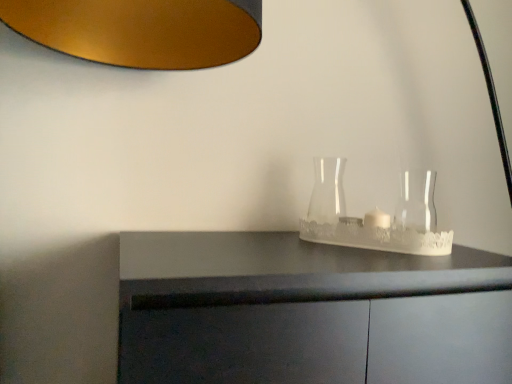
Question: In the image, is transparent glass vase at center, placed as the 1th glass vase when sorted from left to right, positioned in front of or behind transparent glass vase at right, which is counted as the first glass vase, starting from the right?

Choices:
 (A) front
 (B) behind

Answer: (B)

Question: Visually, is transparent glass vase at center, the second glass vase positioned from the right, positioned to the left or to the right of transparent glass vase at right, the second glass vase viewed from the left?

Choices:
 (A) left
 (B) right

Answer: (A)

Question: Is point (322, 192) closer or farther from the camera than point (433, 206)?

Choices:
 (A) farther
 (B) closer

Answer: (B)

Question: From a real-world perspective, relative to transparent glass vase at center, placed as the 1th glass vase when sorted from left to right, is transparent glass vase at right, the second glass vase viewed from the left, vertically above or below?

Choices:
 (A) below
 (B) above

Answer: (A)

Question: Relative to transparent glass vase at center, the second glass vase positioned from the right, is transparent glass vase at right, which is counted as the first glass vase, starting from the right, in front or behind?

Choices:
 (A) front
 (B) behind

Answer: (A)

Question: In terms of height, does transparent glass vase at right, the second glass vase viewed from the left, look taller or shorter compared to transparent glass vase at center, placed as the 1th glass vase when sorted from left to right?

Choices:
 (A) tall
 (B) short

Answer: (B)

Question: Is point (401, 192) positioned closer to the camera than point (318, 173)?

Choices:
 (A) closer
 (B) farther

Answer: (B)